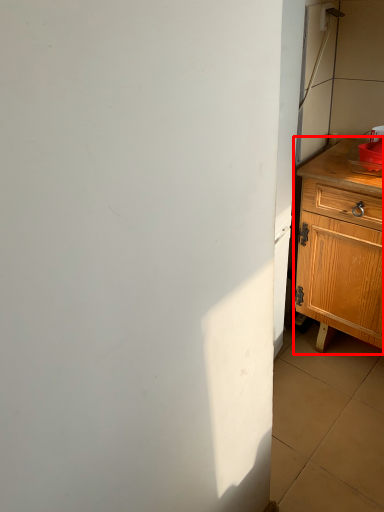
Question: From the image's perspective, where is chest of drawers (annotated by the red box) located relative to sink?

Choices:
 (A) above
 (B) below

Answer: (B)